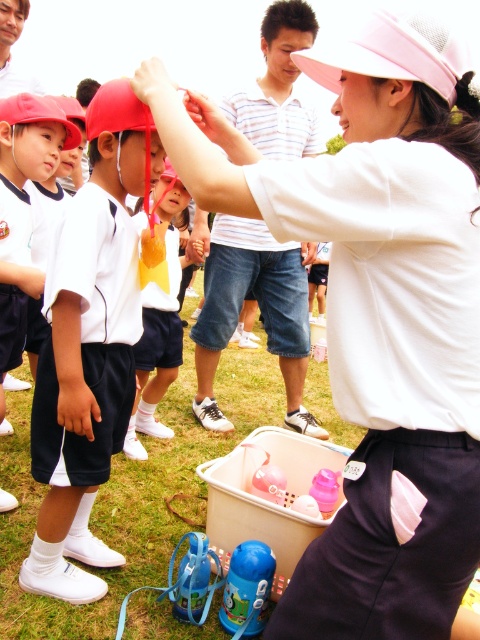
Consider the image. Is matte white shorts at lower left in front of matte yellow cap at center?

No, matte white shorts at lower left is behind matte yellow cap at center.

Which is more to the right, matte white shorts at lower left or matte yellow cap at center?

matte yellow cap at center

Who is more forward, (8, 122) or (177, 180)?

Positioned in front is point (8, 122).

Locate an element on the screen. matte white shorts at lower left is located at coordinates (23, 209).

Is white matte visor at upper center above matte yellow cap at center?

Incorrect, white matte visor at upper center is not positioned above matte yellow cap at center.

This screenshot has height=640, width=480. I want to click on white matte visor at upper center, so click(375, 314).

Is white matte visor at upper center further to camera compared to pink mesh baseball hat at upper center?

No.

Consider the image. Who is higher up, white matte visor at upper center or pink mesh baseball hat at upper center?

Positioned higher is pink mesh baseball hat at upper center.

Which is behind, point (472, 189) or point (427, 61)?

Point (427, 61)

The width and height of the screenshot is (480, 640). I want to click on white matte visor at upper center, so click(375, 314).